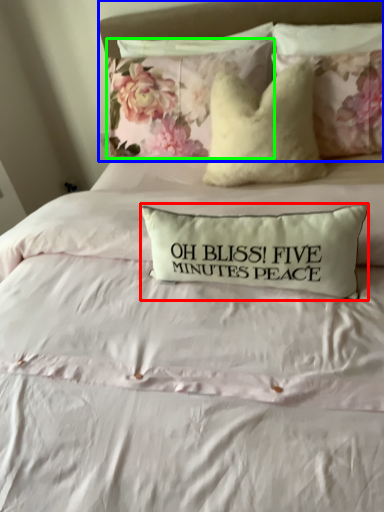
Question: Estimate the real-world distances between objects in this image. Which object is closer to pillow (highlighted by a red box), headboard (highlighted by a blue box) or pillow (highlighted by a green box)?

Choices:
 (A) headboard
 (B) pillow

Answer: (B)